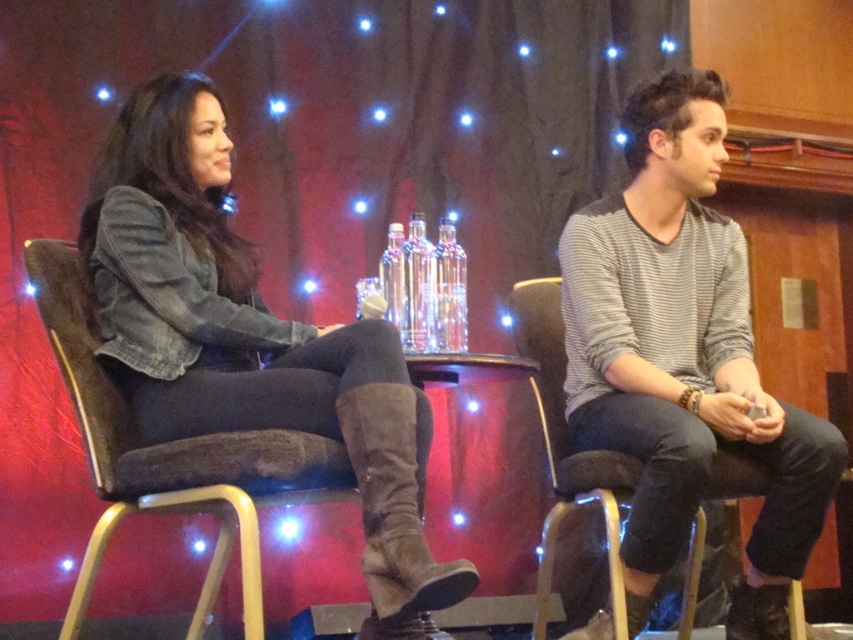
Based on the coordinates provided, which object in the scene corresponds to the point labeled as point (173,458)?

The point (173,458) corresponds to the brown fabric chair at left.